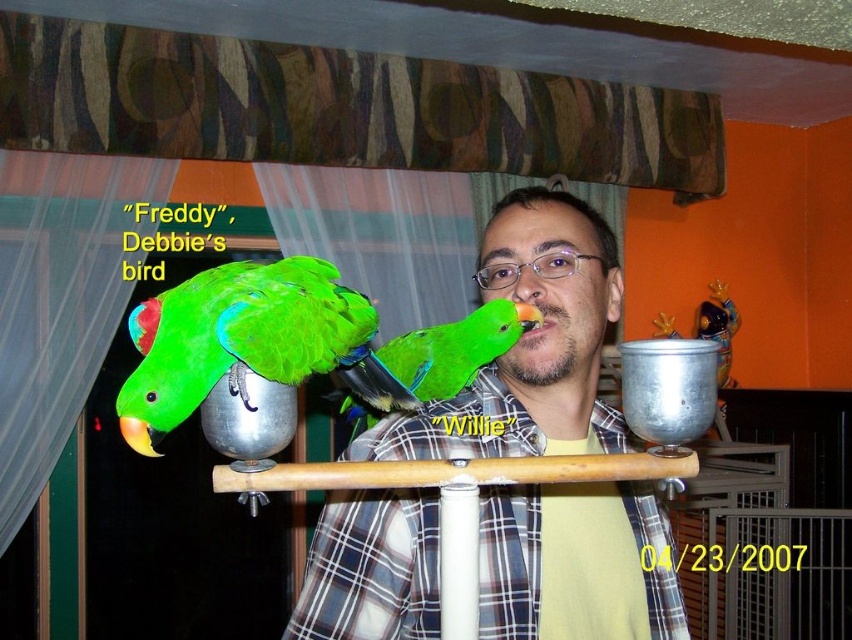
Question: Where is green matte parrot at left located in relation to green matte parrot at center in the image?

Choices:
 (A) left
 (B) right

Answer: (A)

Question: Can you confirm if matte green parrot at center is positioned above green matte parrot at left?

Choices:
 (A) yes
 (B) no

Answer: (B)

Question: Which of the following is the farthest from the observer?

Choices:
 (A) pyautogui.click(x=396, y=371)
 (B) pyautogui.click(x=202, y=307)

Answer: (A)

Question: Which point is closer to the camera taking this photo?

Choices:
 (A) (453, 368)
 (B) (482, 369)

Answer: (A)

Question: Among these objects, which one is farthest from the camera?

Choices:
 (A) green matte parrot at left
 (B) green matte parrot at center

Answer: (B)

Question: Is matte green parrot at center further to camera compared to green matte parrot at left?

Choices:
 (A) yes
 (B) no

Answer: (A)